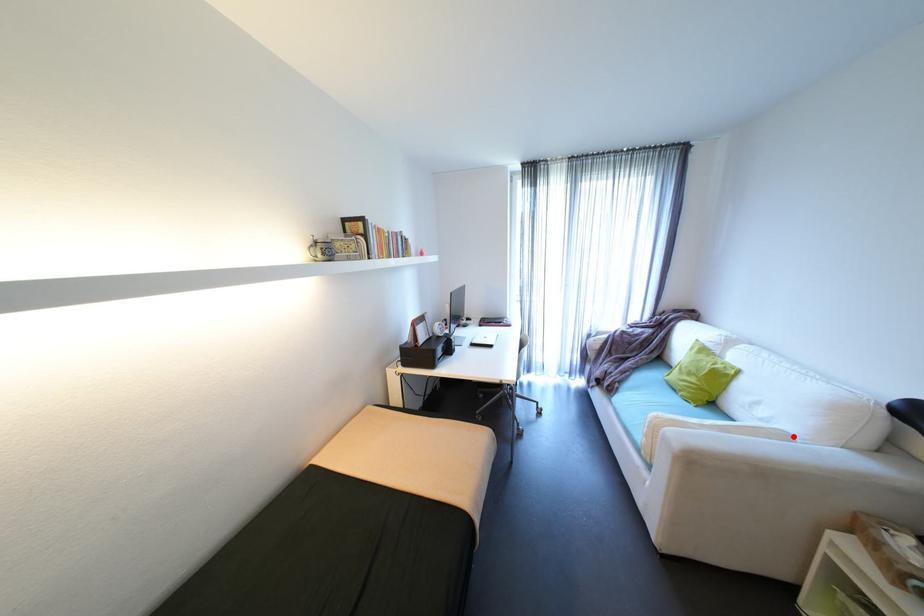
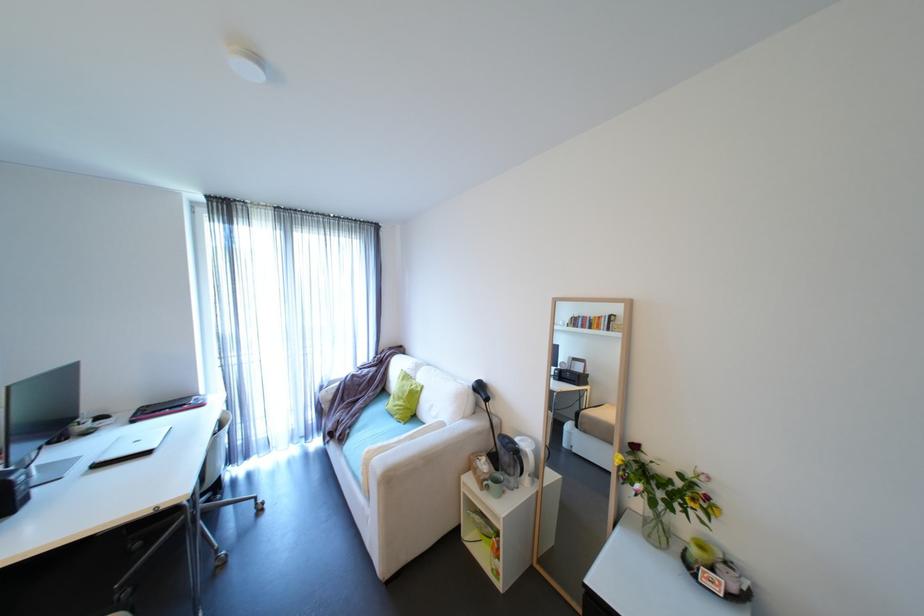
Locate, in the second image, the point that corresponds to the highlighted location in the first image.

(450, 424)